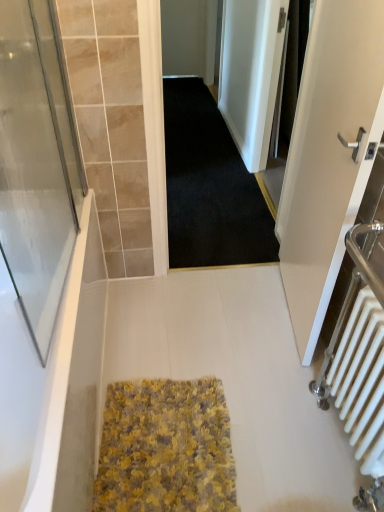
In order to click on free space that is to the left of white matte door at right in this screenshot , I will do `click(229, 318)`.